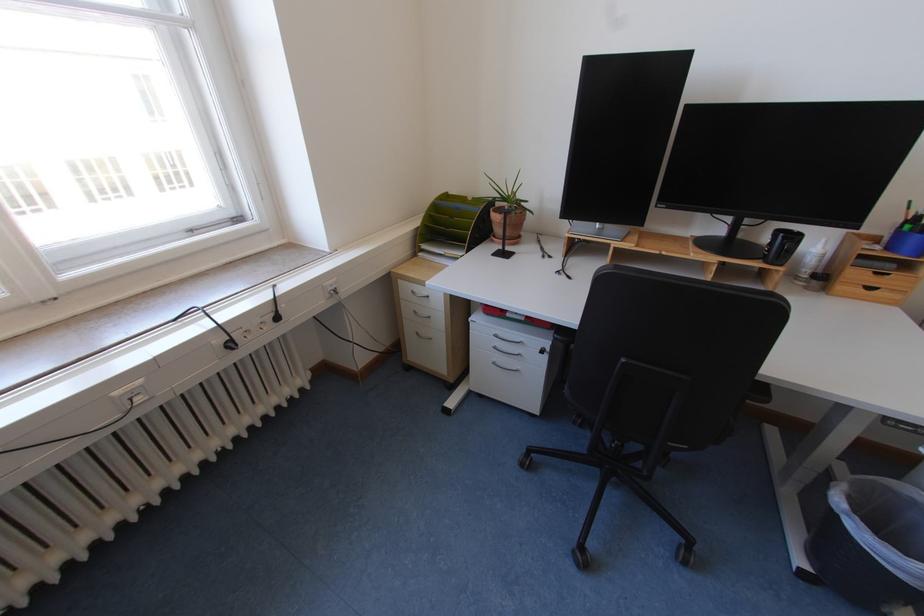
Describe the element at coordinates (818, 265) in the screenshot. I see `the spray bottle trigger` at that location.